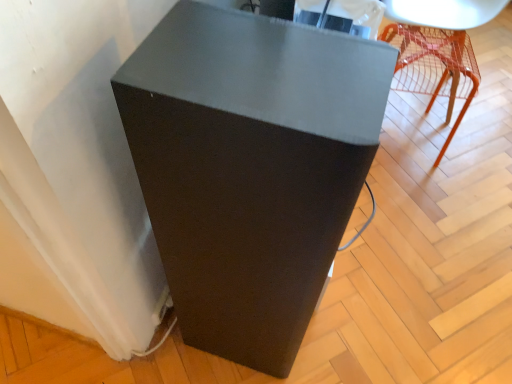
This screenshot has height=384, width=512. Describe the element at coordinates (437, 49) in the screenshot. I see `translucent orange chair at upper right, which ranks as the 1th furniture in right-to-left order` at that location.

Find the location of a particular element. This screenshot has height=384, width=512. translucent orange chair at upper right, the second furniture positioned from the left is located at coordinates (437, 49).

The height and width of the screenshot is (384, 512). What do you see at coordinates (250, 167) in the screenshot?
I see `matte black speaker at lower left, marked as the 2th furniture in a right-to-left arrangement` at bounding box center [250, 167].

How much space does matte black speaker at lower left, marked as the 2th furniture in a right-to-left arrangement, occupy horizontally?

matte black speaker at lower left, marked as the 2th furniture in a right-to-left arrangement, is 15.65 inches wide.

I want to click on matte black speaker at lower left, which is the second furniture from back to front, so click(x=250, y=167).

What are the coordinates of `translucent orange chair at upper right, placed as the first furniture when sorted from top to bottom` in the screenshot? It's located at (437, 49).

Looking at this image, which is more to the left, translucent orange chair at upper right, which ranks as the 1th furniture in right-to-left order, or matte black speaker at lower left, which is the 2th furniture in top-to-bottom order?

From the viewer's perspective, matte black speaker at lower left, which is the 2th furniture in top-to-bottom order, appears more on the left side.

Is translucent orange chair at upper right, which ranks as the 1th furniture in right-to-left order, positioned in front of matte black speaker at lower left, the 1th furniture when ordered from bottom to top?

That is False.

Is point (424, 58) positioned before point (136, 146)?

No, (424, 58) is further to viewer.

From the image's perspective, between translucent orange chair at upper right, the 2th furniture in the bottom-to-top sequence, and matte black speaker at lower left, marked as the 2th furniture in a right-to-left arrangement, which one is located above?

translucent orange chair at upper right, the 2th furniture in the bottom-to-top sequence, appears higher in the image.

From a real-world perspective, between translucent orange chair at upper right, the second furniture positioned from the left, and matte black speaker at lower left, the 1th furniture when ordered from bottom to top, who is vertically higher?

From a 3D spatial view, matte black speaker at lower left, the 1th furniture when ordered from bottom to top, is above.

Considering the relative sizes of translucent orange chair at upper right, the second furniture positioned from the left, and matte black speaker at lower left, marked as the 2th furniture in a right-to-left arrangement, in the image provided, is translucent orange chair at upper right, the second furniture positioned from the left, thinner than matte black speaker at lower left, marked as the 2th furniture in a right-to-left arrangement,?

Correct, the width of translucent orange chair at upper right, the second furniture positioned from the left, is less than that of matte black speaker at lower left, marked as the 2th furniture in a right-to-left arrangement.

Which of these two, translucent orange chair at upper right, which ranks as the 1th furniture in right-to-left order, or matte black speaker at lower left, which is the second furniture from back to front, stands taller?

matte black speaker at lower left, which is the second furniture from back to front, is taller.

Considering the relative sizes of translucent orange chair at upper right, which appears as the first furniture when viewed from the back, and matte black speaker at lower left, which is the 2th furniture in top-to-bottom order, in the image provided, is translucent orange chair at upper right, which appears as the first furniture when viewed from the back, bigger than matte black speaker at lower left, which is the 2th furniture in top-to-bottom order,?

Incorrect, translucent orange chair at upper right, which appears as the first furniture when viewed from the back, is not larger than matte black speaker at lower left, which is the 2th furniture in top-to-bottom order.

Would you say translucent orange chair at upper right, the 2th furniture in the bottom-to-top sequence, is outside matte black speaker at lower left, the 1th furniture when ordered from bottom to top?

Yes, translucent orange chair at upper right, the 2th furniture in the bottom-to-top sequence, is not within matte black speaker at lower left, the 1th furniture when ordered from bottom to top.

Are translucent orange chair at upper right, which appears as the first furniture when viewed from the back, and matte black speaker at lower left, which is the 2th furniture in top-to-bottom order, far apart?

That's right, there is a large distance between translucent orange chair at upper right, which appears as the first furniture when viewed from the back, and matte black speaker at lower left, which is the 2th furniture in top-to-bottom order.

Is translucent orange chair at upper right, the 2th furniture in the bottom-to-top sequence, positioned with its back to matte black speaker at lower left, which is the second furniture from back to front?

No, translucent orange chair at upper right, the 2th furniture in the bottom-to-top sequence, is not facing the opposite direction of matte black speaker at lower left, which is the second furniture from back to front.

Image resolution: width=512 pixels, height=384 pixels. In order to click on furniture that is above the matte black speaker at lower left, which is the 2th furniture in top-to-bottom order (from the image's perspective) in this screenshot , I will do `click(437, 49)`.

From the picture: Is matte black speaker at lower left, which is the second furniture from back to front, at the right side of translucent orange chair at upper right, the 2th furniture in the bottom-to-top sequence?

No, matte black speaker at lower left, which is the second furniture from back to front, is not to the right of translucent orange chair at upper right, the 2th furniture in the bottom-to-top sequence.

Does matte black speaker at lower left, which is the 1th furniture in front-to-back order, come behind translucent orange chair at upper right, the second furniture positioned from the left?

No, matte black speaker at lower left, which is the 1th furniture in front-to-back order, is closer to the viewer.

Which is farther from the camera, (x=148, y=76) or (x=438, y=1)?

Point (x=438, y=1)

From the image's perspective, which one is positioned higher, matte black speaker at lower left, marked as the 2th furniture in a right-to-left arrangement, or translucent orange chair at upper right, the second furniture positioned from the left?

From the image's view, translucent orange chair at upper right, the second furniture positioned from the left, is above.

From a real-world perspective, which is physically below, matte black speaker at lower left, which is the second furniture from back to front, or translucent orange chair at upper right, the second furniture in the front-to-back sequence?

translucent orange chair at upper right, the second furniture in the front-to-back sequence, from a real-world perspective.

Considering the sizes of matte black speaker at lower left, which appears as the 1th furniture when viewed from the left, and translucent orange chair at upper right, which appears as the first furniture when viewed from the back, in the image, is matte black speaker at lower left, which appears as the 1th furniture when viewed from the left, wider or thinner than translucent orange chair at upper right, which appears as the first furniture when viewed from the back,?

Considering their sizes, matte black speaker at lower left, which appears as the 1th furniture when viewed from the left, looks broader than translucent orange chair at upper right, which appears as the first furniture when viewed from the back.

Is matte black speaker at lower left, which is the 1th furniture in front-to-back order, shorter than translucent orange chair at upper right, the second furniture positioned from the left?

No.

Who is bigger, matte black speaker at lower left, which is the 1th furniture in front-to-back order, or translucent orange chair at upper right, placed as the first furniture when sorted from top to bottom?

matte black speaker at lower left, which is the 1th furniture in front-to-back order.

Is matte black speaker at lower left, marked as the 2th furniture in a right-to-left arrangement, not inside translucent orange chair at upper right, placed as the first furniture when sorted from top to bottom?

Yes, matte black speaker at lower left, marked as the 2th furniture in a right-to-left arrangement, is not within translucent orange chair at upper right, placed as the first furniture when sorted from top to bottom.

Would you say matte black speaker at lower left, the 1th furniture when ordered from bottom to top, is a long distance from translucent orange chair at upper right, the 2th furniture in the bottom-to-top sequence?

Indeed, matte black speaker at lower left, the 1th furniture when ordered from bottom to top, is not near translucent orange chair at upper right, the 2th furniture in the bottom-to-top sequence.

Does matte black speaker at lower left, which is the second furniture from back to front, turn towards translucent orange chair at upper right, which ranks as the 1th furniture in right-to-left order?

No, matte black speaker at lower left, which is the second furniture from back to front, does not turn towards translucent orange chair at upper right, which ranks as the 1th furniture in right-to-left order.

Can you tell me how much matte black speaker at lower left, which is the 1th furniture in front-to-back order, and translucent orange chair at upper right, the second furniture positioned from the left, differ in facing direction?

10.9 degrees separate the facing orientations of matte black speaker at lower left, which is the 1th furniture in front-to-back order, and translucent orange chair at upper right, the second furniture positioned from the left.

Find the location of `furniture that appears below the translucent orange chair at upper right, which ranks as the 1th furniture in right-to-left order (from the image's perspective)`. furniture that appears below the translucent orange chair at upper right, which ranks as the 1th furniture in right-to-left order (from the image's perspective) is located at coordinates (250, 167).

Locate an element on the screen. furniture lying in front of the translucent orange chair at upper right, the second furniture positioned from the left is located at coordinates (250, 167).

Locate an element on the screen. The image size is (512, 384). furniture beneath the matte black speaker at lower left, marked as the 2th furniture in a right-to-left arrangement (from a real-world perspective) is located at coordinates (437, 49).